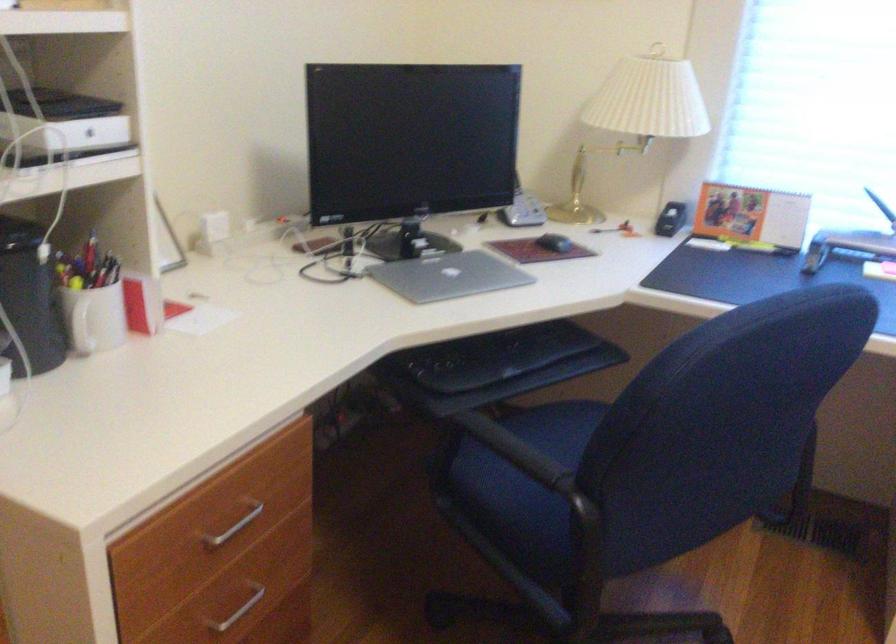
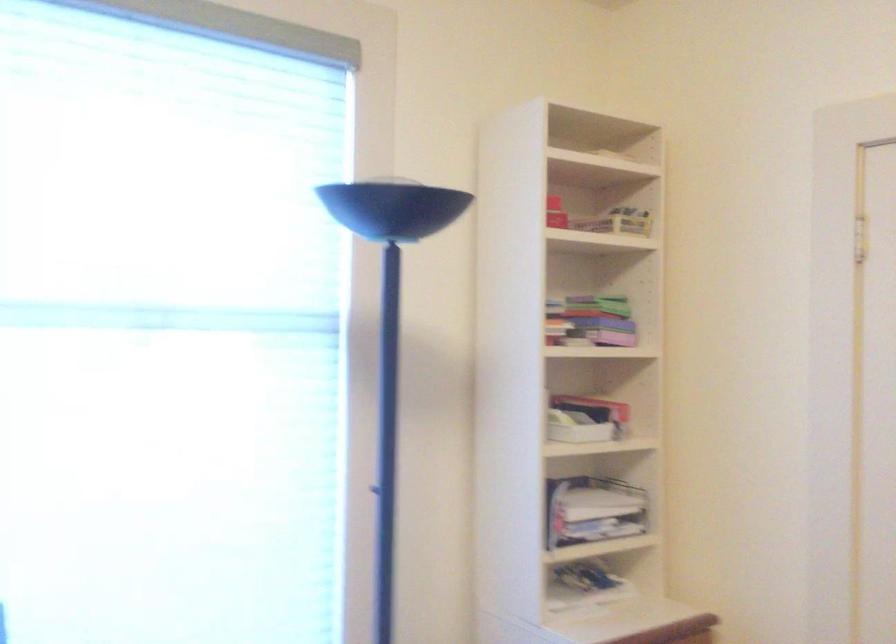
Question: The images are taken continuously from a first-person perspective. In which direction is your viewpoint rotating?

Choices:
 (A) Left
 (B) Right
 (C) Up
 (D) Down

Answer: (B)